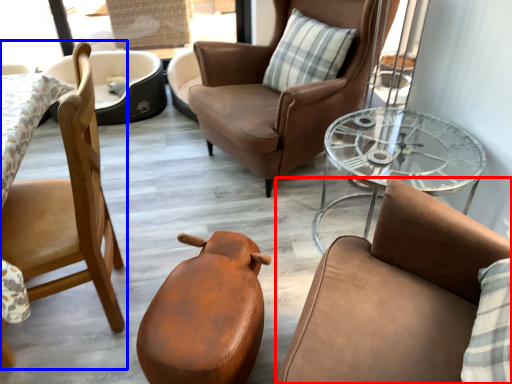
Question: Which object appears closest to the camera in this image, chair (highlighted by a red box) or chair (highlighted by a blue box)?

Choices:
 (A) chair
 (B) chair

Answer: (A)